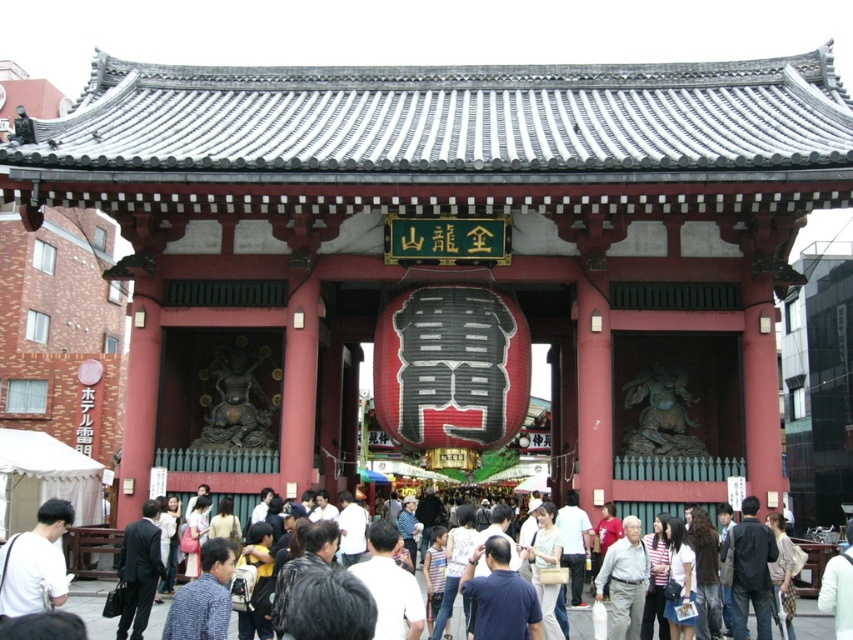
You are a traveler standing in front of a traditional Japanese temple gate in Tokyo. You notice a white cotton shirt at center and a light brown textured bag at center. Which item is located to the left of the other?

The white cotton shirt at center is positioned on the left side of light brown textured bag at center.

You are standing in front of a traditional Japanese temple gate in Tokyo. You see a point marked at coordinates (625, 580). What object is located at that point?

The point at coordinates (625, 580) marks the gray fabric shirt at center.

You are a photographer standing in front of the traditional Japanese temple gate. You notice a person wearing a gray fabric shirt at center and have dark brown hair at center. Can you determine which item is covering the other?

The gray fabric shirt at center is positioned over dark brown hair at center, so the shirt is covering the hair.